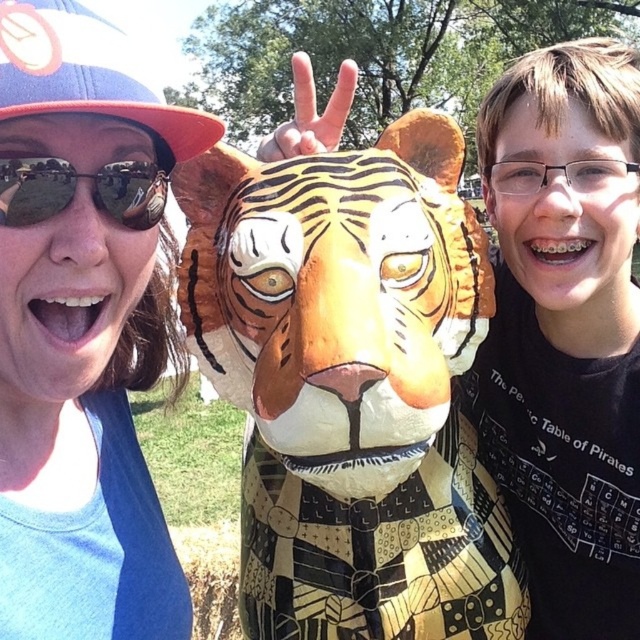
You are standing in the scene and want to move from the point labeled as point [38,588] to the point labeled as point [144,200]. Which direction should you face to walk towards the second point?

You should face towards the direction of point [144,200], which is behind point [38,588] according to the spatial relationship described.

You are a photographer trying to capture a closeup shot of the matte black sunglasses at left and the matte blue shirt at left. The minimum focus distance of your camera is 6 inches. Can you focus on both objects simultaneously without adjusting your position?

The matte blue shirt at left and the matte black sunglasses at left are 6.75 inches apart. Since the minimum focus distance is 6 inches, the camera can focus on both objects as the distance between them is within the focus range.